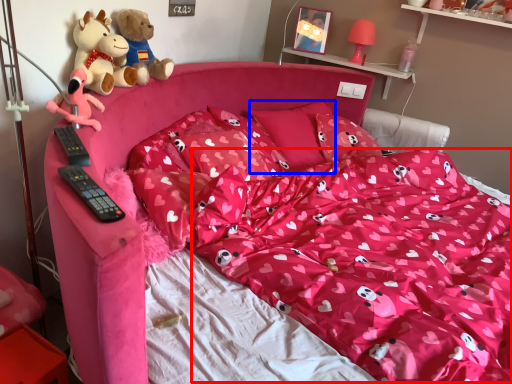
Question: Which object is closer to the camera taking this photo, blanket (highlighted by a red box) or pillow (highlighted by a blue box)?

Choices:
 (A) blanket
 (B) pillow

Answer: (A)